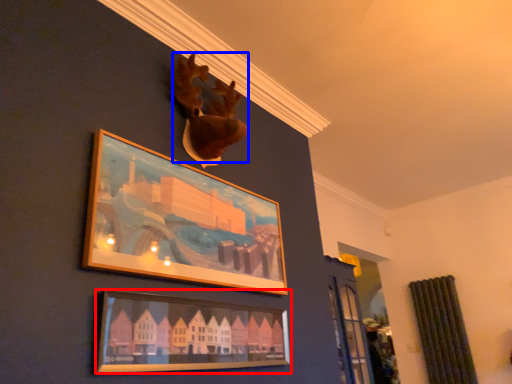
Question: Which point is further to the camera, picture frame (highlighted by a red box) or animal (highlighted by a blue box)?

Choices:
 (A) picture frame
 (B) animal

Answer: (B)